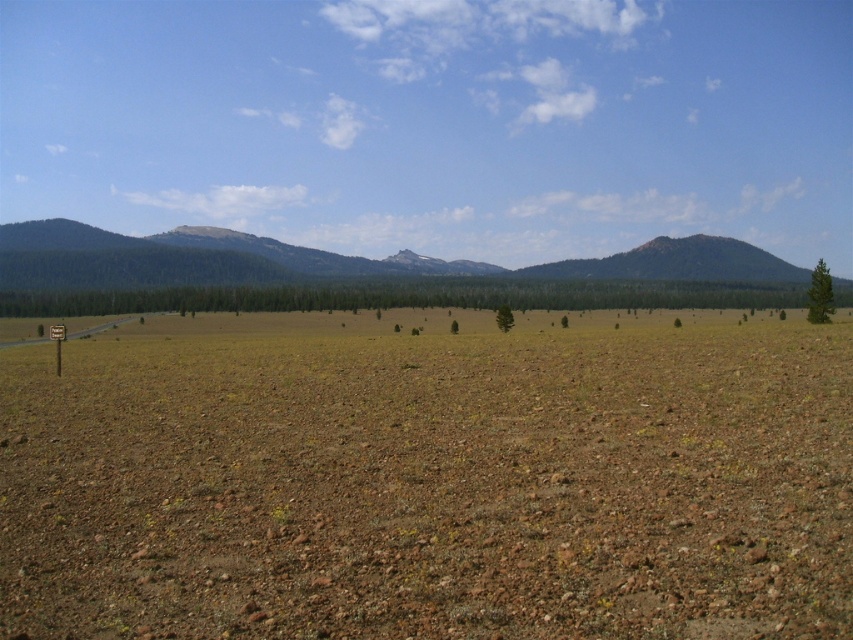
Question: Which of the following is the closest to the observer?

Choices:
 (A) (773, 266)
 (B) (521, 540)
 (C) (828, 304)

Answer: (B)

Question: Among these objects, which one is farthest from the camera?

Choices:
 (A) green textured tree at right
 (B) green matte tree at center

Answer: (B)

Question: Observing the image, what is the correct spatial positioning of brown gravelly dirt field at center in reference to green matte tree at center?

Choices:
 (A) left
 (B) right

Answer: (A)

Question: Is green matte tree at center further to camera compared to green textured tree at right?

Choices:
 (A) no
 (B) yes

Answer: (B)

Question: Estimate the real-world distances between objects in this image. Which object is closer to the green textured tree at right?

Choices:
 (A) green matte tree at center
 (B) green textured tree at center
 (C) green forested mountain at center

Answer: (B)

Question: Is green forested mountain at center smaller than green matte tree at center?

Choices:
 (A) yes
 (B) no

Answer: (B)